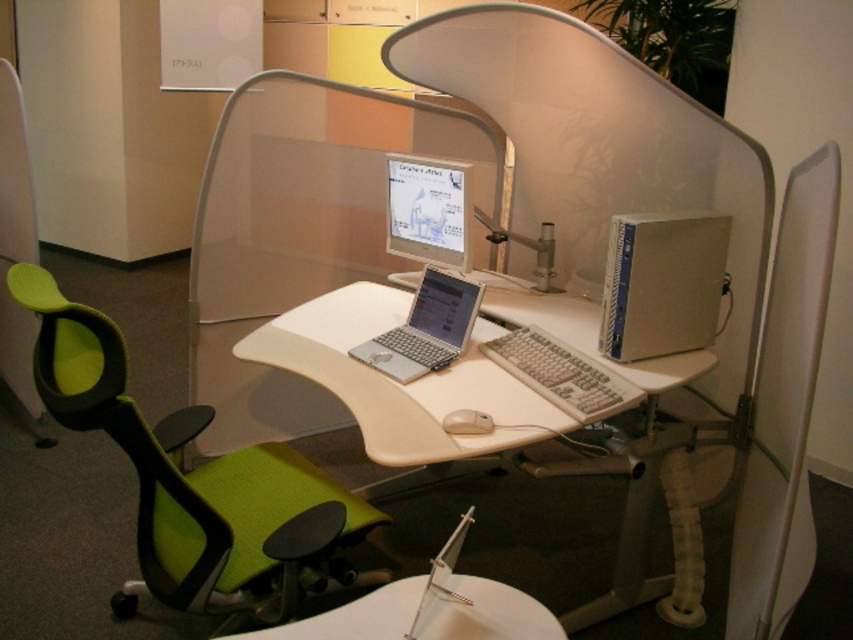
Does white plastic desk at center appear over satin silver computer tower at right?

No.

Does white plastic desk at center come in front of satin silver computer tower at right?

That is True.

Does point (573, 321) come closer to viewer compared to point (693, 320)?

No, it is behind (693, 320).

Locate an element on the screen. white plastic desk at center is located at coordinates (405, 380).

From the picture: Is green mesh swivel chair at left positioned in front of white plastic desk at center?

Yes, green mesh swivel chair at left is closer to the viewer.

Between green mesh swivel chair at left and white plastic desk at center, which one has more height?

white plastic desk at center is taller.

Where is `green mesh swivel chair at left`? green mesh swivel chair at left is located at coordinates (194, 477).

Is point (27, 288) behind point (606, 305)?

No, it is not.

The width and height of the screenshot is (853, 640). Identify the location of green mesh swivel chair at left. (194, 477).